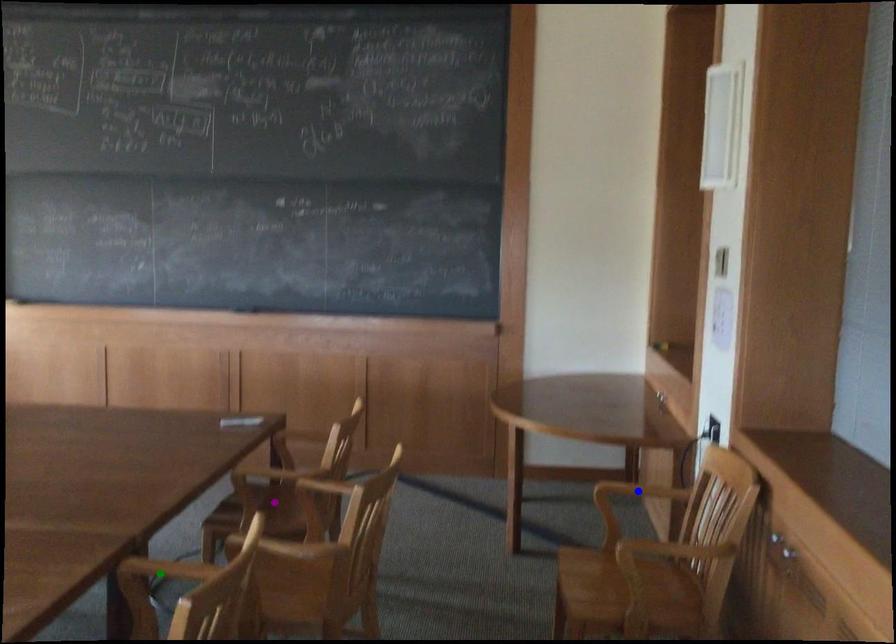
Order these from nearest to farthest:
1. blue point
2. green point
3. purple point

green point < blue point < purple point